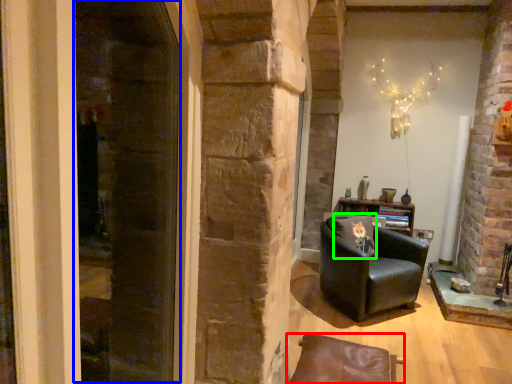
Question: Which object is the closest to the chair (highlighted by a red box)? Choose among these: screen door (highlighted by a blue box) or pillow (highlighted by a green box).

Choices:
 (A) screen door
 (B) pillow

Answer: (B)